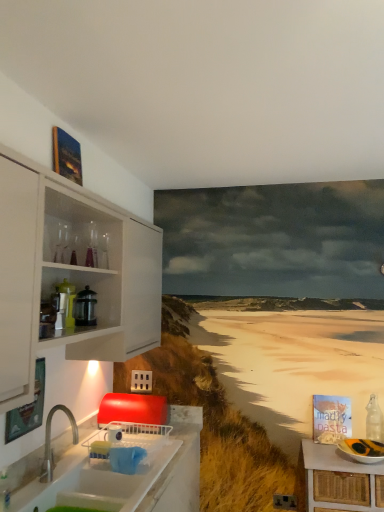
Question: From the image's perspective, is white wicker table at lower right beneath white glossy countertop at lower left?

Choices:
 (A) no
 (B) yes

Answer: (B)

Question: Can you confirm if white wicker table at lower right is positioned to the right of white glossy countertop at lower left?

Choices:
 (A) yes
 (B) no

Answer: (A)

Question: From a real-world perspective, is white wicker table at lower right on white glossy countertop at lower left?

Choices:
 (A) yes
 (B) no

Answer: (B)

Question: Is white wicker table at lower right behind white glossy countertop at lower left?

Choices:
 (A) yes
 (B) no

Answer: (A)

Question: Can you confirm if white wicker table at lower right is wider than white glossy countertop at lower left?

Choices:
 (A) no
 (B) yes

Answer: (A)

Question: From the image's perspective, relative to metallic glass coffee press at upper left, is white glossy countertop at lower left above or below?

Choices:
 (A) above
 (B) below

Answer: (B)

Question: Considering the positions of white glossy countertop at lower left and metallic glass coffee press at upper left in the image, is white glossy countertop at lower left wider or thinner than metallic glass coffee press at upper left?

Choices:
 (A) thin
 (B) wide

Answer: (B)

Question: Considering the positions of white glossy countertop at lower left and metallic glass coffee press at upper left in the image, is white glossy countertop at lower left bigger or smaller than metallic glass coffee press at upper left?

Choices:
 (A) small
 (B) big

Answer: (B)

Question: Do you think white glossy countertop at lower left is within metallic glass coffee press at upper left, or outside of it?

Choices:
 (A) inside
 (B) outside

Answer: (B)

Question: In terms of height, does white glossy countertop at lower left look taller or shorter compared to clear glass bottle at right?

Choices:
 (A) tall
 (B) short

Answer: (A)

Question: Is point (29, 493) closer or farther from the camera than point (370, 400)?

Choices:
 (A) farther
 (B) closer

Answer: (B)

Question: Is white glossy countertop at lower left to the left or to the right of clear glass bottle at right in the image?

Choices:
 (A) left
 (B) right

Answer: (A)

Question: From the image's perspective, is white glossy countertop at lower left above or below clear glass bottle at right?

Choices:
 (A) above
 (B) below

Answer: (A)

Question: Does point (382, 438) appear closer or farther from the camera than point (57, 483)?

Choices:
 (A) farther
 (B) closer

Answer: (A)

Question: Visually, is clear glass bottle at right positioned to the left or to the right of white glossy countertop at lower left?

Choices:
 (A) right
 (B) left

Answer: (A)